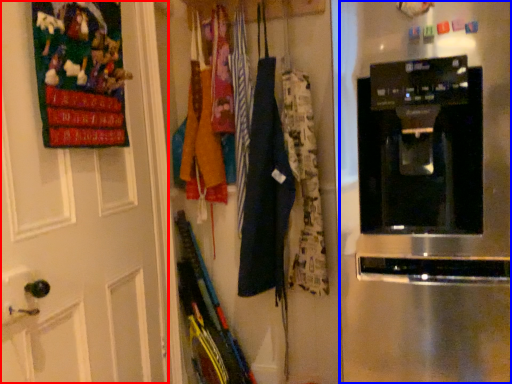
Question: Which object is further to the camera taking this photo, door (highlighted by a red box) or home appliance (highlighted by a blue box)?

Choices:
 (A) door
 (B) home appliance

Answer: (A)